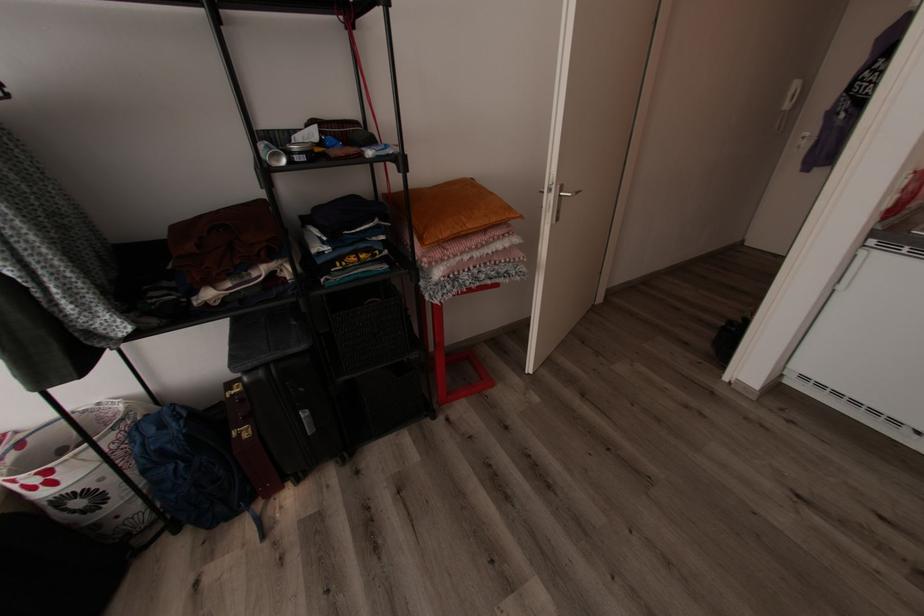
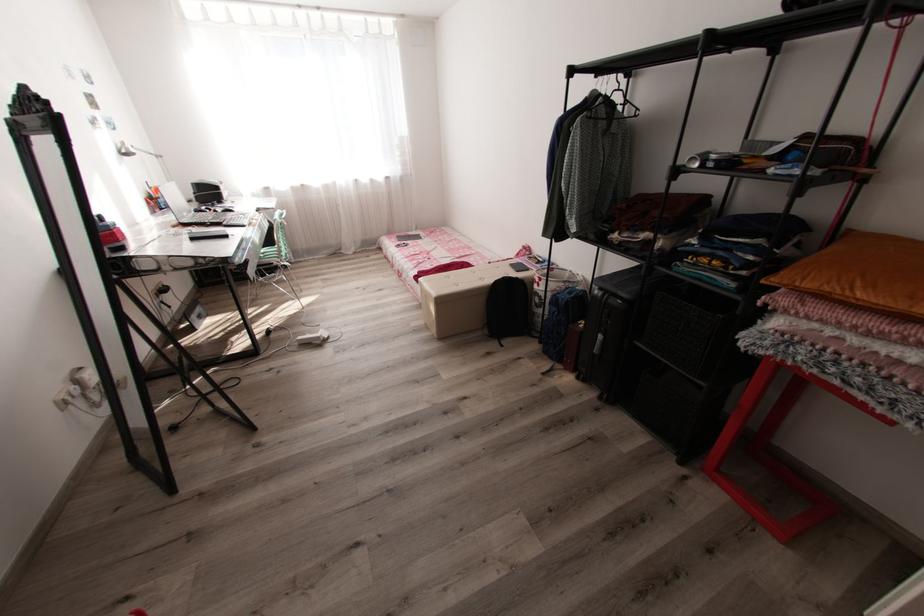
Where in the second image is the point corresponding to point (475, 229) from the first image?

(861, 299)